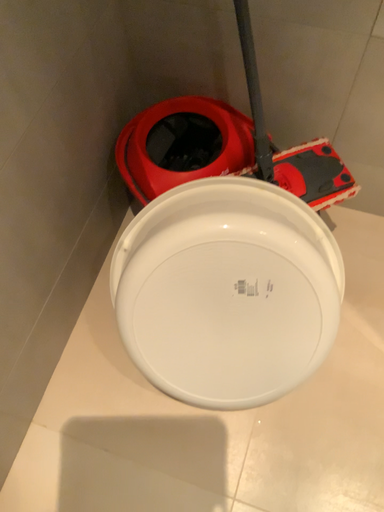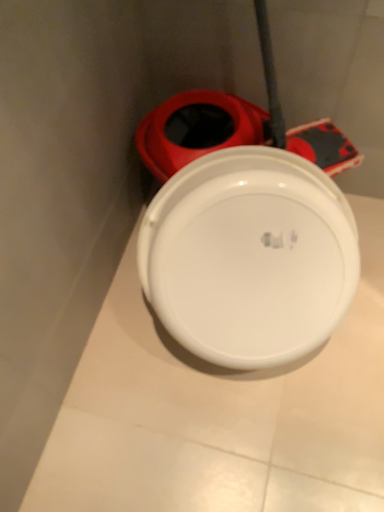
Question: Which way did the camera rotate in the video?

Choices:
 (A) rotated downward
 (B) rotated upward

Answer: (B)